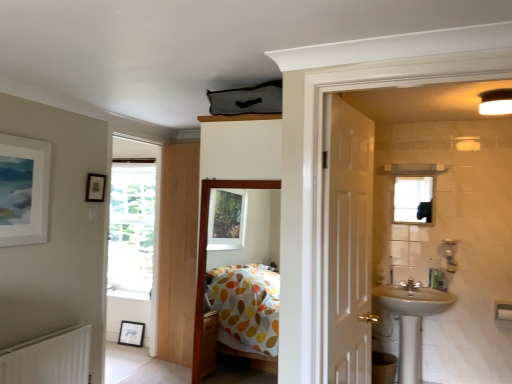
Find the location of `free space in front of silver metallic tap at right`. free space in front of silver metallic tap at right is located at coordinates point(418,297).